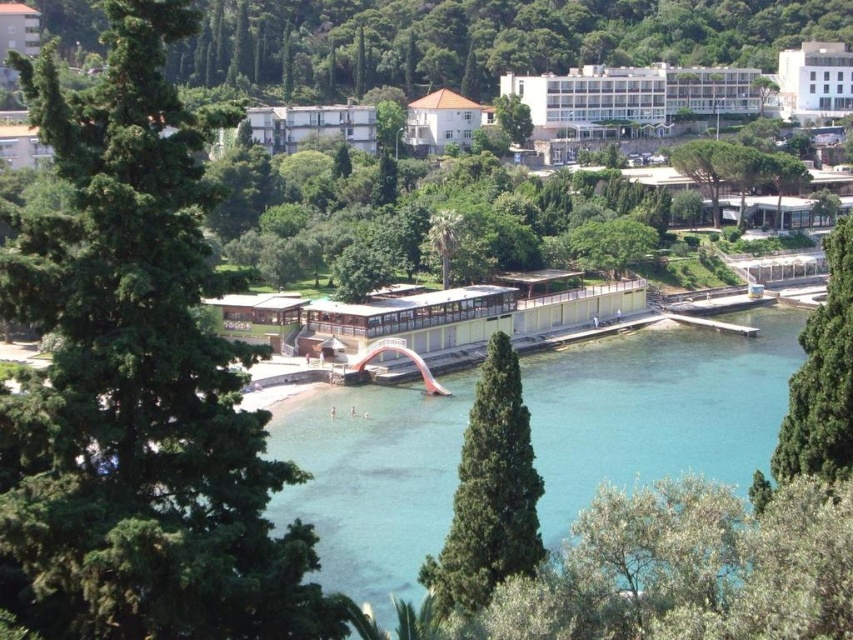
Who is taller, white smooth building at upper right or white concrete building at center?

Standing taller between the two is white smooth building at upper right.

Between point (784, 81) and point (260, 124), which one is positioned behind?

The point (784, 81) is more distant.

Image resolution: width=853 pixels, height=640 pixels. I want to click on white smooth building at upper right, so click(815, 80).

Is green leafy tree at right to the right of green leafy tree at upper center from the viewer's perspective?

No, green leafy tree at right is not to the right of green leafy tree at upper center.

Locate an element on the screen. green leafy tree at right is located at coordinates (822, 376).

Who is more forward, [815,444] or [775,93]?

Point [815,444] is in front.

Where is `green leafy tree at right`? green leafy tree at right is located at coordinates (822, 376).

Between white smooth building at upper center and white concrete building at center, which one appears on the right side from the viewer's perspective?

white smooth building at upper center

Who is more distant from viewer, (740, 97) or (294, 144)?

Positioned behind is point (740, 97).

Find the location of a particular element. The width and height of the screenshot is (853, 640). white smooth building at upper center is located at coordinates (634, 93).